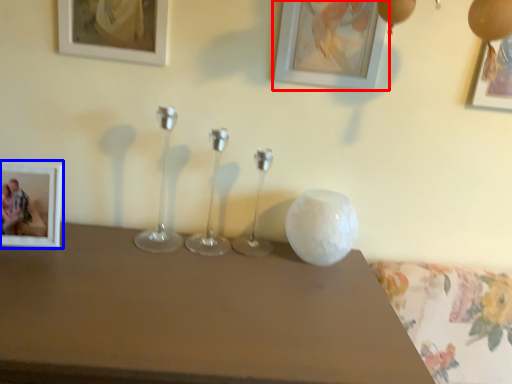
Question: Which object is further to the camera taking this photo, picture frame (highlighted by a red box) or picture frame (highlighted by a blue box)?

Choices:
 (A) picture frame
 (B) picture frame

Answer: (A)